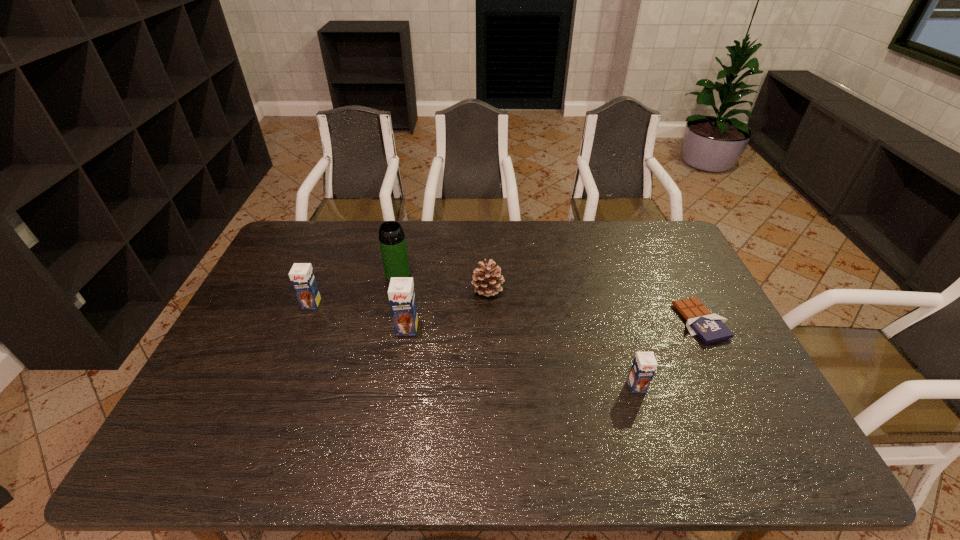
In order to click on object that is the fourth closest one to the shortest object in this screenshot , I will do `click(392, 241)`.

Identify which object is located as the fifth nearest to the rightmost object. Please provide its 2D coordinates. Your answer should be formatted as a tuple, i.e. [(x, y)], where the tuple contains the x and y coordinates of a point satisfying the conditions above.

[(302, 277)]

Identify which chocolate milk is the nearest to the fourth object from left to right. Please provide its 2D coordinates. Your answer should be formatted as a tuple, i.e. [(x, y)], where the tuple contains the x and y coordinates of a point satisfying the conditions above.

[(401, 292)]

Image resolution: width=960 pixels, height=540 pixels. What are the coordinates of `chocolate milk that is the second closest one to the farthest chocolate milk` in the screenshot? It's located at (644, 365).

This screenshot has width=960, height=540. I want to click on free space that satisfies the following two spatial constraints: 1. from the spout of the pinecone; 2. on the left side of the tallest object, so click(395, 289).